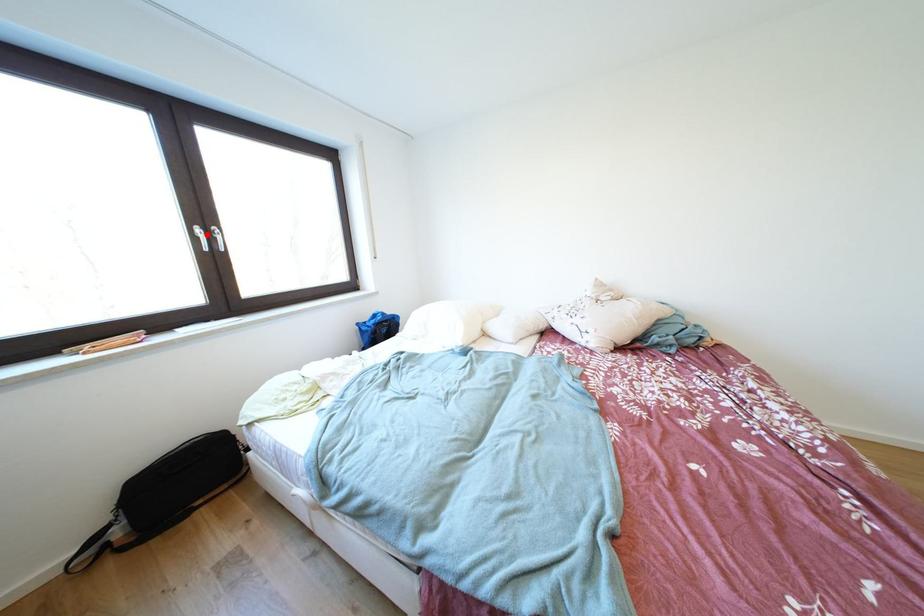
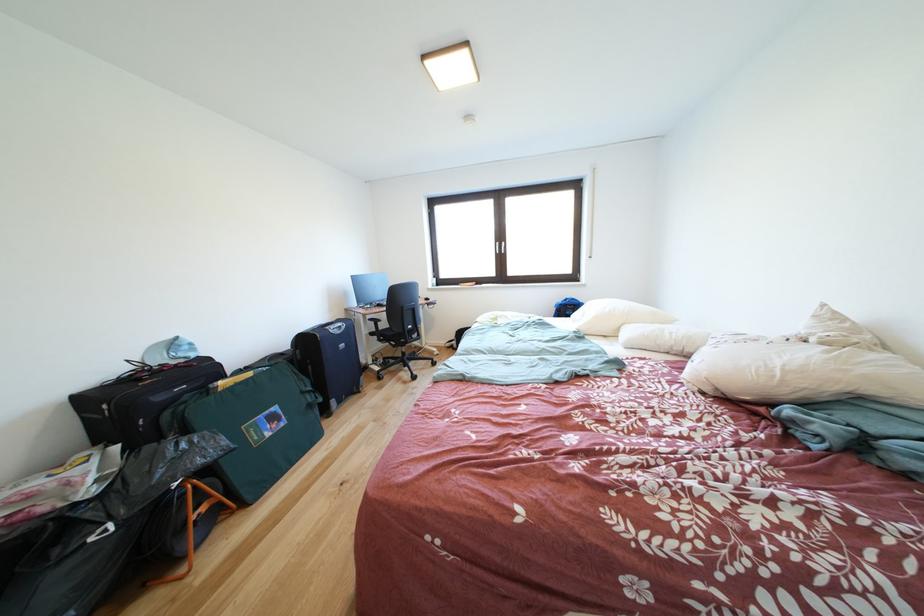
Locate, in the second image, the point that corresponds to the highlighted location in the first image.

(505, 249)